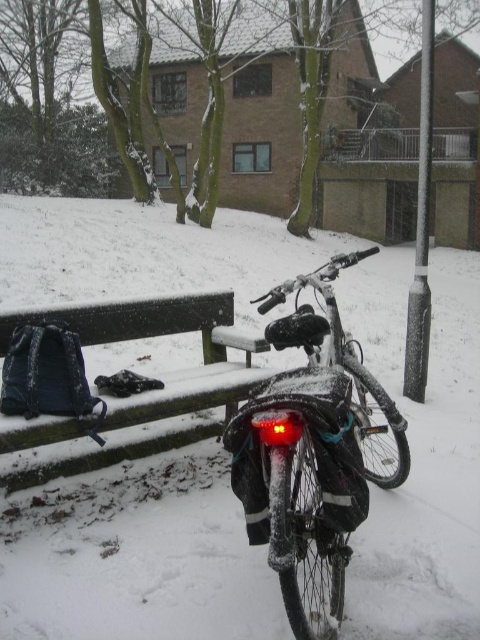
Who is higher up, dark blue fabric bench at lower left or sleek metallic pole at right?

→ sleek metallic pole at right is above.

Looking at this image, can you confirm if dark blue fabric bench at lower left is positioned below sleek metallic pole at right?

Yes.

This screenshot has height=640, width=480. What are the coordinates of `dark blue fabric bench at lower left` in the screenshot? It's located at (137, 394).

Consider the image. Is white matte snow at center above shiny metallic bicycle at center?

Correct, white matte snow at center is located above shiny metallic bicycle at center.

Based on the photo, does white matte snow at center appear on the left side of shiny metallic bicycle at center?

Correct, you'll find white matte snow at center to the left of shiny metallic bicycle at center.

Who is more forward, (3,566) or (241,448)?

Point (241,448) is in front.

You are a GUI agent. You are given a task and a screenshot of the screen. Output one action in this format:
    pyautogui.click(x=<x>, y=<y>)
    Task: Click on the white matte snow at center
    
    Given the screenshot: What is the action you would take?
    pyautogui.click(x=136, y=557)

Is point (454, 365) more distant than point (407, 324)?

No, (454, 365) is closer to viewer.

Between white matte snow at center and sleek metallic pole at right, which one appears on the left side from the viewer's perspective?

From the viewer's perspective, white matte snow at center appears more on the left side.

Where is `white matte snow at center`? white matte snow at center is located at coordinates (136, 557).